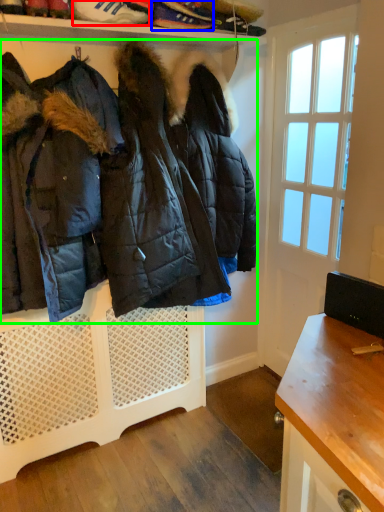
Question: Which is farther away from footwear (highlighted by a red box)? footwear (highlighted by a blue box) or jacket (highlighted by a green box)?

Choices:
 (A) footwear
 (B) jacket

Answer: (B)